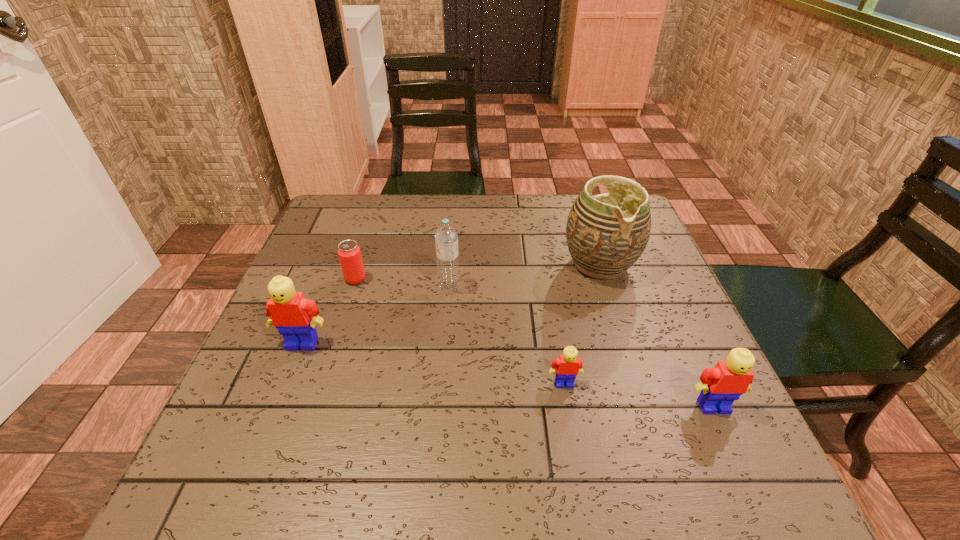
You are a GUI agent. You are given a task and a screenshot of the screen. Output one action in this format:
    pyautogui.click(x=<x>, y=<y>)
    Task: Click on the vacant region located 0.150m on the front of the water bottle
    This screenshot has width=960, height=540.
    Given the screenshot: What is the action you would take?
    pyautogui.click(x=444, y=345)

Identify the location of vacant space situated on the left of the pottery. This screenshot has width=960, height=540. (481, 264).

Identify the location of vacant space located 0.230m on the front of the beer can. This screenshot has height=540, width=960. (328, 366).

I want to click on object positioned at the far edge, so click(606, 234).

Where is `object present at the near edge`? This screenshot has width=960, height=540. object present at the near edge is located at coordinates (722, 385).

The image size is (960, 540). Find the location of `Lego present at the left edge`. Lego present at the left edge is located at coordinates (295, 317).

Locate an element on the screen. The height and width of the screenshot is (540, 960). beer can at the left edge is located at coordinates (349, 253).

Find the location of a particular element. Image resolution: width=960 pixels, height=540 pixels. Lego positioned at the right edge is located at coordinates (722, 385).

This screenshot has height=540, width=960. Identify the location of pottery positioned at the right edge. (606, 234).

Identify the location of object positioned at the far right corner. (606, 234).